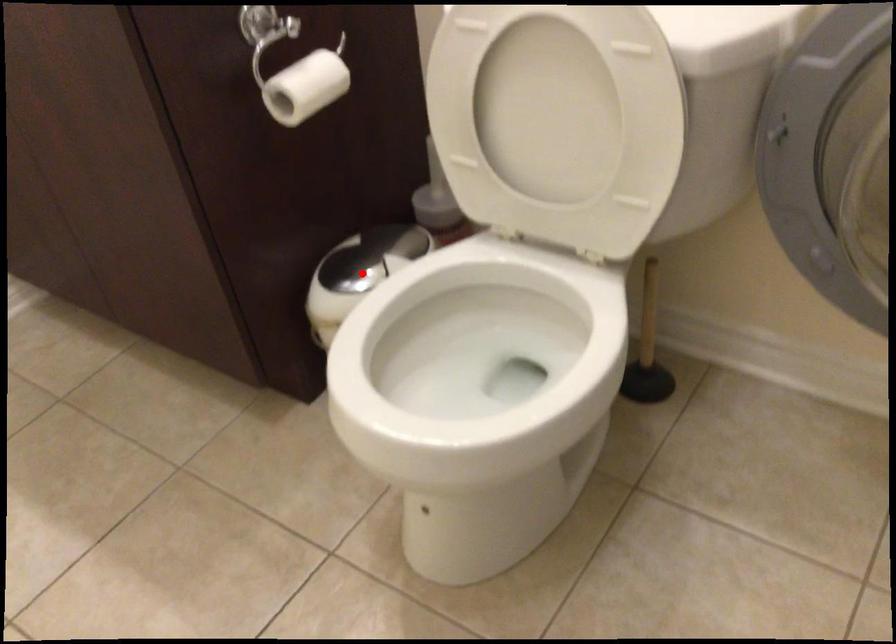
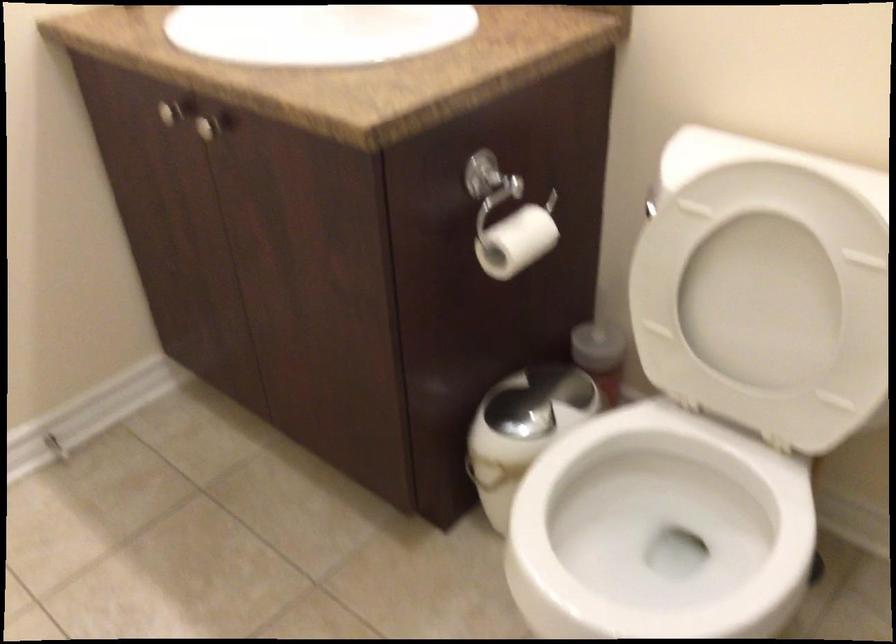
In the second image, find the point that corresponds to the highlighted location in the first image.

(529, 413)